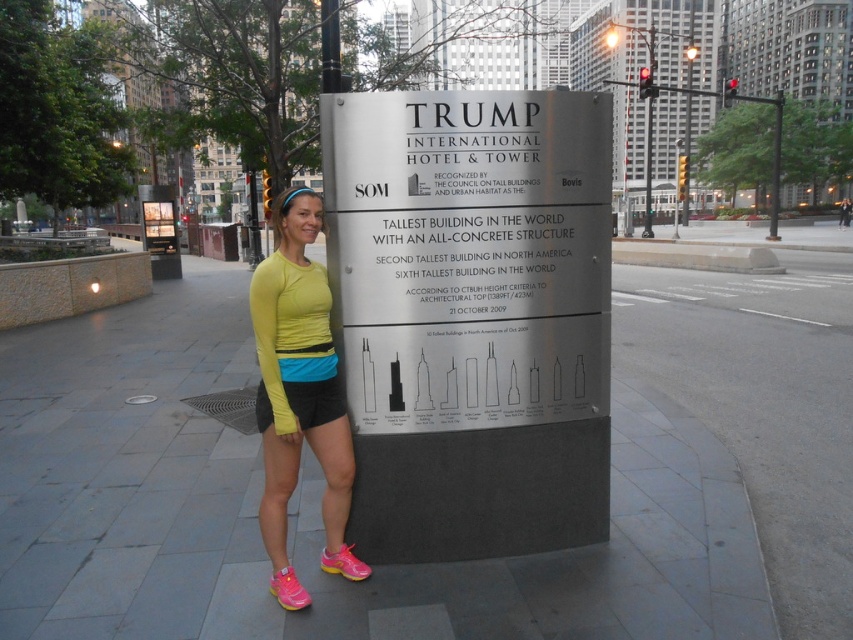
Question: Which of these objects is positioned closest to the metallic streetlight at upper right?

Choices:
 (A) yellow matte long-sleeve shirt at center
 (B) black fabric shorts at center
 (C) metallic pole at upper center

Answer: (C)

Question: Which object is closer to the camera taking this photo?

Choices:
 (A) metallic pole at upper center
 (B) yellow matte long-sleeve shirt at center
 (C) metallic streetlight at upper right
 (D) silver metallic sign at center

Answer: (B)

Question: Can you confirm if yellow matte long-sleeve shirt at center is positioned above black fabric shorts at center?

Choices:
 (A) yes
 (B) no

Answer: (A)

Question: Which of these objects is positioned closest to the silver metallic sign at center?

Choices:
 (A) yellow matte long-sleeve shirt at center
 (B) metallic streetlight at upper right
 (C) black fabric shorts at center

Answer: (A)

Question: Is yellow matte long-sleeve shirt at center wider than black fabric shorts at center?

Choices:
 (A) yes
 (B) no

Answer: (A)

Question: Is yellow matte long-sleeve shirt at center further to camera compared to metallic streetlight at upper right?

Choices:
 (A) yes
 (B) no

Answer: (B)